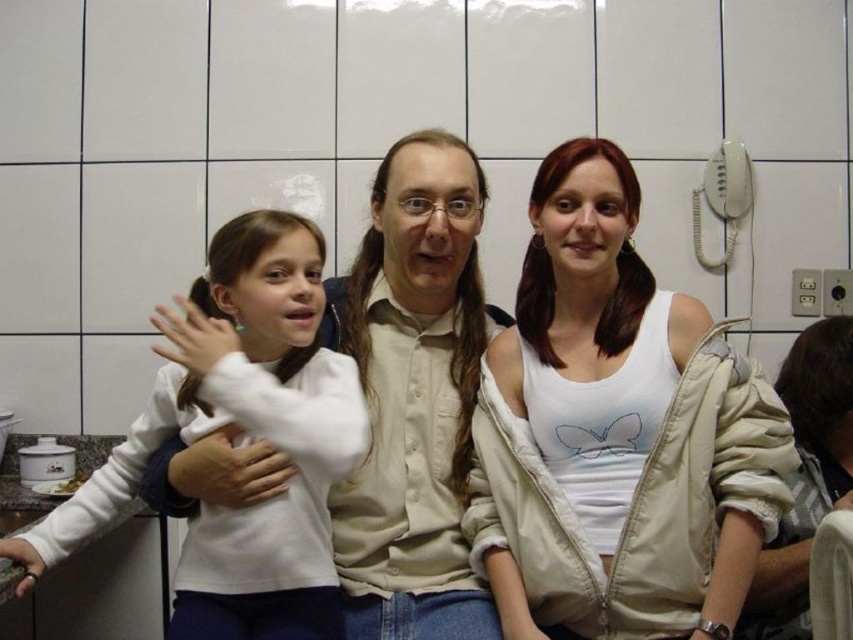
You are a fashion designer observing a group of people in a kitchen. You notice two shirts in the scene. Which shirt, the white matte shirt at center or the white soft fabric shirt at left, is taller?

The white matte shirt at center is taller than the white soft fabric shirt at left.

You are organizing a clothing donation drive and need to separate the white cotton tank top at center and the white matte shirt at center based on their positions. Which one is positioned to the right?

The white cotton tank top at center is positioned to the right of the white matte shirt at center.